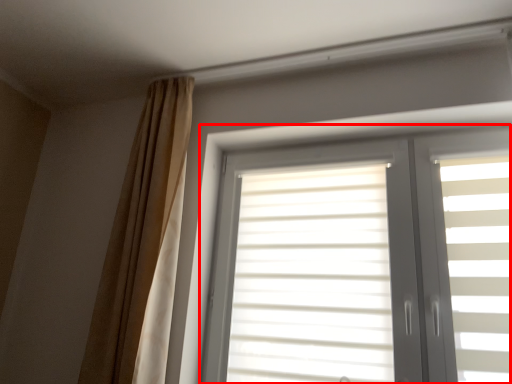
Question: From the image's perspective, what is the correct spatial relationship of window (annotated by the red box) in relation to curtain?

Choices:
 (A) below
 (B) above

Answer: (A)